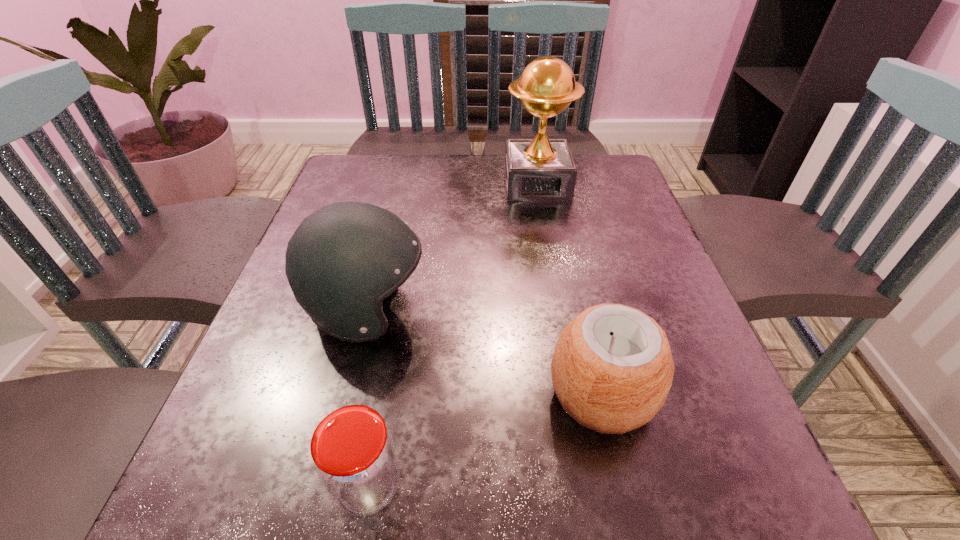
Locate an element on the screen. free spot at the far left corner of the desktop is located at coordinates (376, 160).

Find the location of `vacant space at the near left corner`. vacant space at the near left corner is located at coordinates (224, 483).

Identify the location of free spot at the far right corner of the desktop. This screenshot has width=960, height=540. (633, 189).

Image resolution: width=960 pixels, height=540 pixels. In order to click on vacant area at the near right corner of the desktop in this screenshot , I will do `click(708, 500)`.

You are a GUI agent. You are given a task and a screenshot of the screen. Output one action in this format:
    pyautogui.click(x=<x>, y=<y>)
    Task: Click on the free spot between the nearest object and the farthest object
    The image size is (960, 540).
    Given the screenshot: What is the action you would take?
    pyautogui.click(x=452, y=335)

You are a GUI agent. You are given a task and a screenshot of the screen. Output one action in this format:
    pyautogui.click(x=<x>, y=<y>)
    Task: Click on the vacant space in between the award and the shortest object
    The width and height of the screenshot is (960, 540).
    Given the screenshot: What is the action you would take?
    pyautogui.click(x=452, y=335)

Where is `free space between the coconut and the football helmet`? The image size is (960, 540). free space between the coconut and the football helmet is located at coordinates (485, 352).

Locate an element on the screen. The width and height of the screenshot is (960, 540). vacant space that's between the farthest object and the football helmet is located at coordinates (452, 247).

The width and height of the screenshot is (960, 540). In order to click on free spot between the football helmet and the farthest object in this screenshot , I will do `click(452, 247)`.

The image size is (960, 540). Identify the location of empty space that is in between the award and the football helmet. (452, 247).